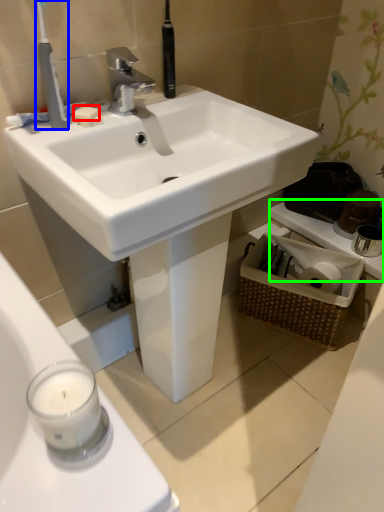
Question: Based on their relative distances, which object is farther from soap (highlighted by a red box)? Choose from toothbrush (highlighted by a blue box) and counter top (highlighted by a green box).

Choices:
 (A) toothbrush
 (B) counter top

Answer: (B)